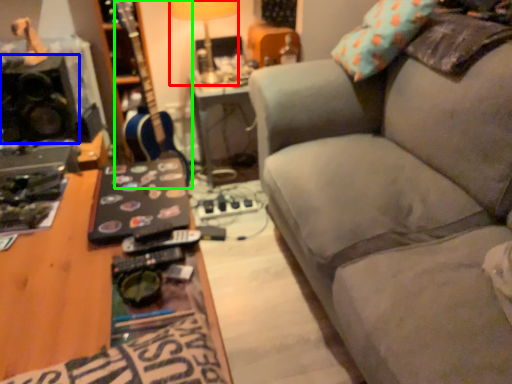
Question: Estimate the real-world distances between objects in this image. Which object is farther from lamp (highlighted by a red box), loudspeaker (highlighted by a blue box) or guitar (highlighted by a green box)?

Choices:
 (A) loudspeaker
 (B) guitar

Answer: (A)